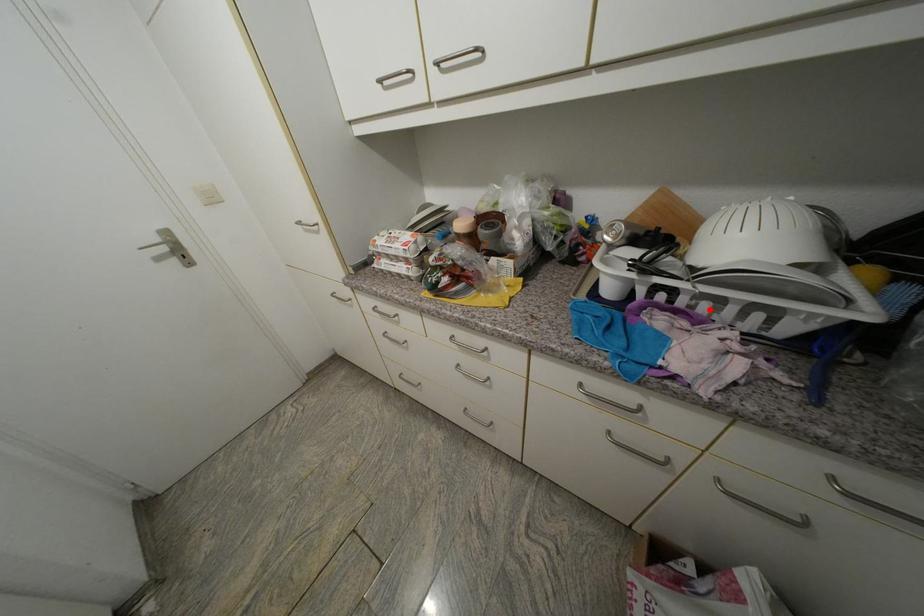
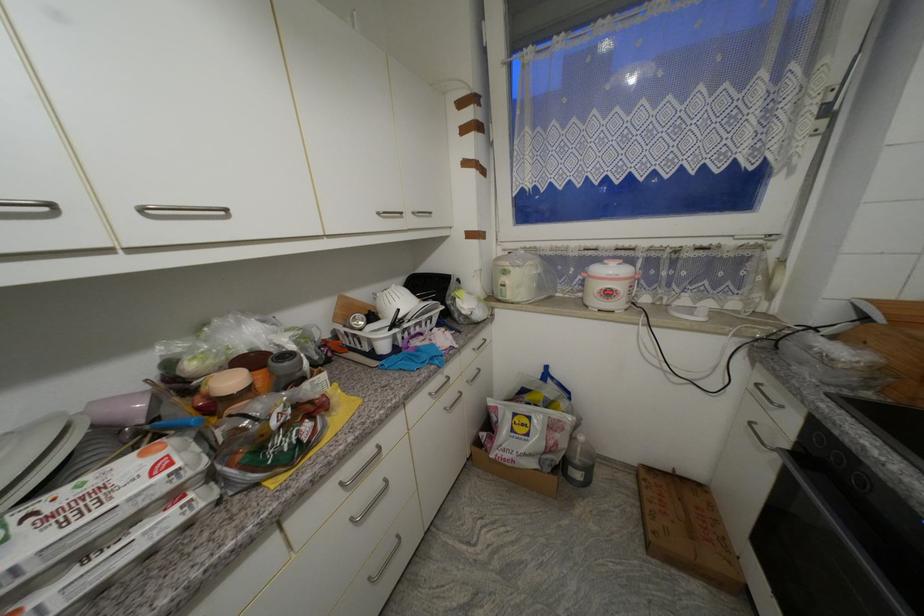
Question: I am providing you with two images of the same scene from different viewpoints. A red point is marked on the first image. Can you still see the location of the red point in image 2?

Choices:
 (A) Yes
 (B) No

Answer: (A)